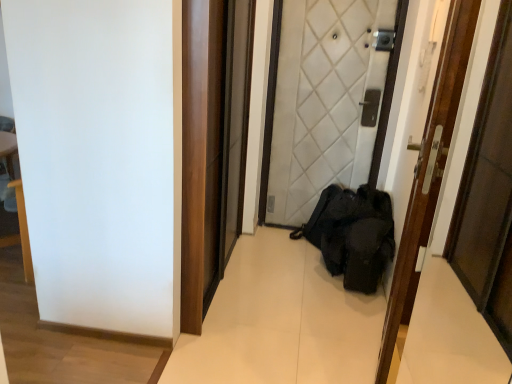
Identify the location of free space to the left of wooden door at center, which is the second door in back-to-front order. (292, 332).